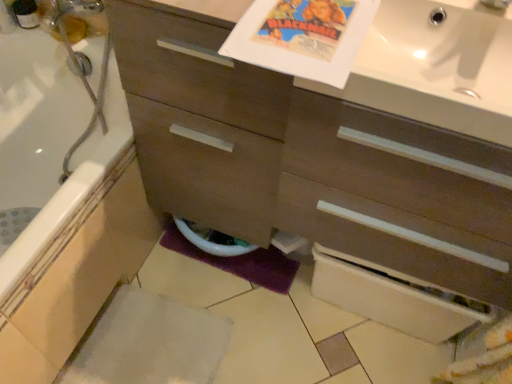
You are a GUI agent. You are given a task and a screenshot of the screen. Output one action in this format:
    pyautogui.click(x=<x>, y=<y>)
    Task: Click on the free space to the right of white glossy toilet bowl at lower center
    This screenshot has height=384, width=512.
    Given the screenshot: What is the action you would take?
    pyautogui.click(x=274, y=271)